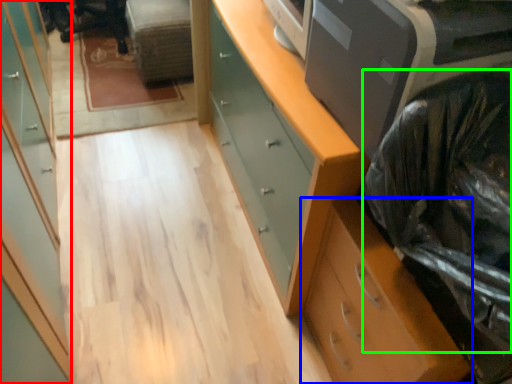
Question: Which object is positioned closest to cabinetry (highlighted by a red box)? Select from chest of drawers (highlighted by a blue box) and garbage (highlighted by a green box).

Choices:
 (A) chest of drawers
 (B) garbage

Answer: (A)